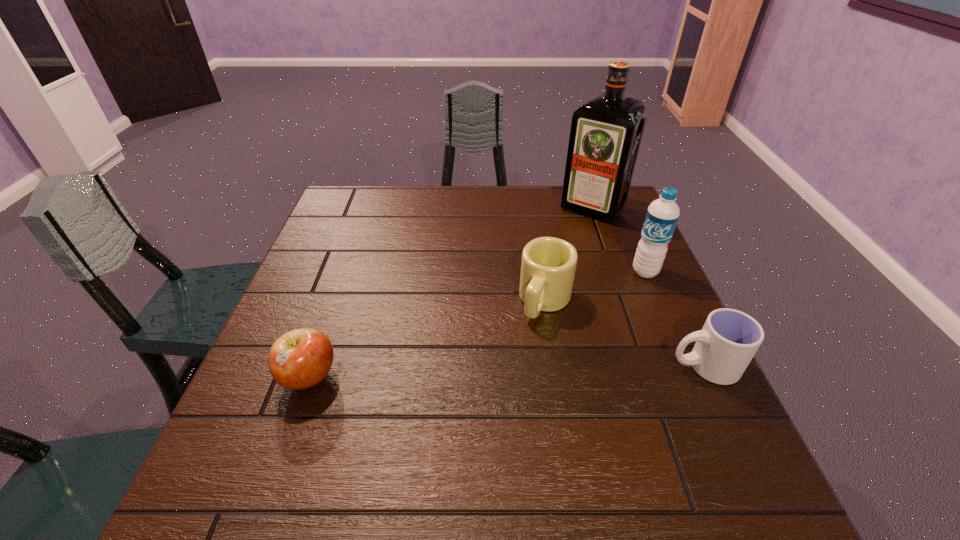
You are a GUI agent. You are given a task and a screenshot of the screen. Output one action in this format:
    pyautogui.click(x=<x>, y=<y>)
    Task: Click on the object located in the left edge section of the desktop
    Image resolution: width=960 pixels, height=540 pixels.
    Given the screenshot: What is the action you would take?
    pyautogui.click(x=299, y=359)

Find the location of `cup at the right edge`. cup at the right edge is located at coordinates (729, 339).

The image size is (960, 540). Find the location of `water bottle positioned at the right edge`. water bottle positioned at the right edge is located at coordinates (662, 215).

Identify the location of liquor positioned at the right edge. The height and width of the screenshot is (540, 960). (606, 131).

Locate an element on the screen. object situated at the far right corner is located at coordinates (606, 131).

You are a GUI agent. You are given a task and a screenshot of the screen. Output one action in this format:
    pyautogui.click(x=<x>, y=<y>)
    Task: Click on the free region at the far edge of the desktop
    This screenshot has height=540, width=960.
    Given the screenshot: What is the action you would take?
    pyautogui.click(x=507, y=222)

I want to click on vacant space at the left edge of the desktop, so click(337, 231).

The image size is (960, 540). I want to click on free space at the far left corner of the desktop, so click(372, 224).

Where is `vacant space at the near left corner`? This screenshot has height=540, width=960. vacant space at the near left corner is located at coordinates (275, 437).

The image size is (960, 540). Find the location of `vacant area at the near right corner of the desktop`. vacant area at the near right corner of the desktop is located at coordinates (679, 417).